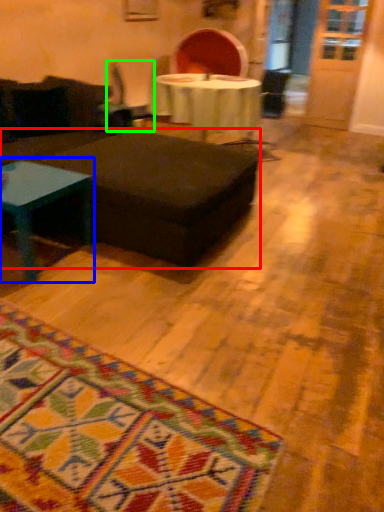
Question: Estimate the real-world distances between objects in this image. Which object is closer to table (highlighted by a red box), coffee table (highlighted by a blue box) or swivel chair (highlighted by a green box)?

Choices:
 (A) coffee table
 (B) swivel chair

Answer: (A)